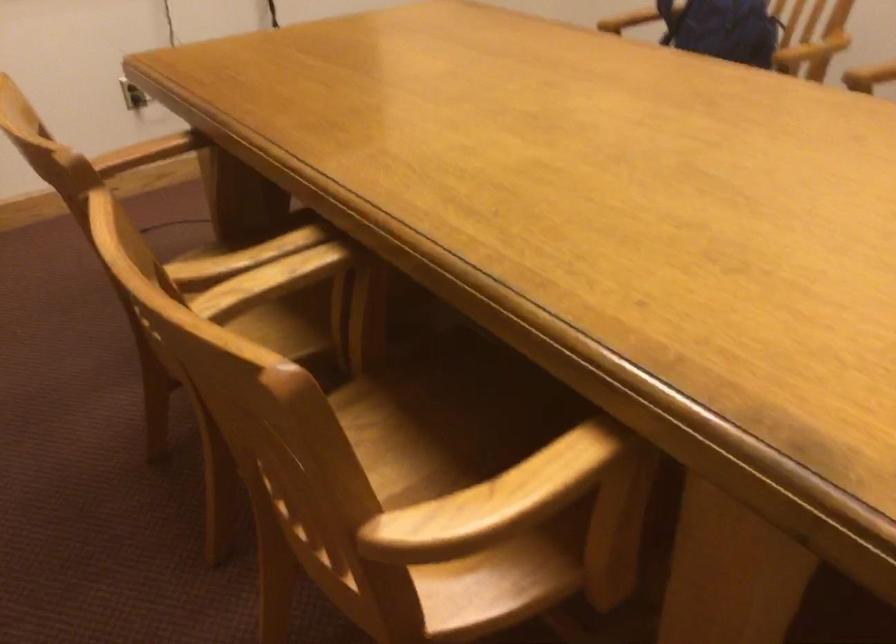
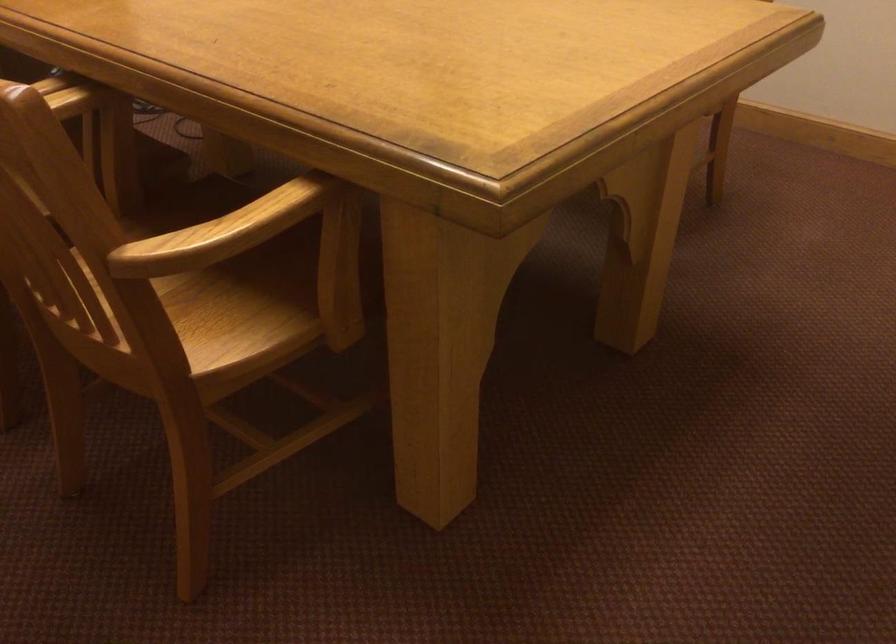
Question: The images are taken continuously from a first-person perspective. In which direction are you moving?

Choices:
 (A) Left
 (B) Right
 (C) Forward
 (D) Backward

Answer: (D)